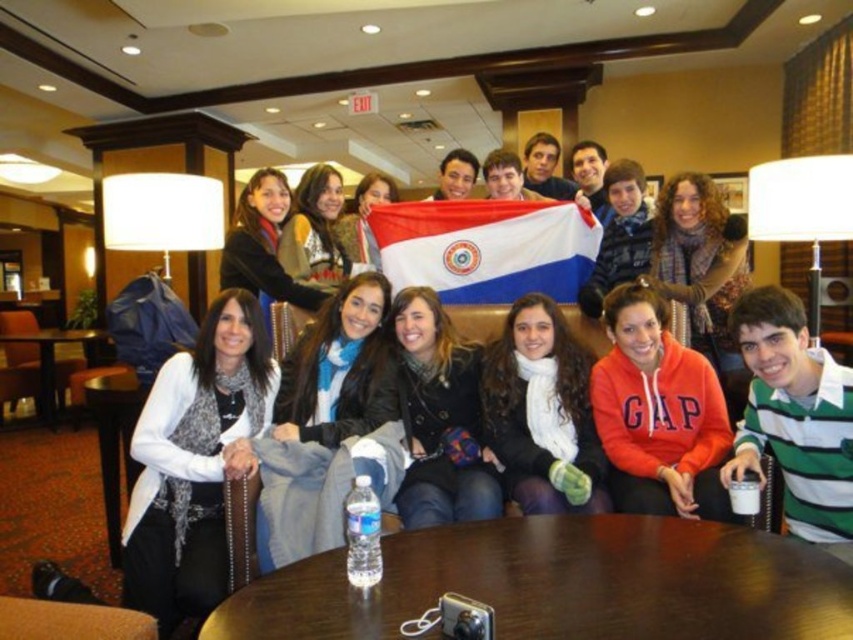
Question: Is wooden table at lower left in front of brown wooden table at lower left?

Choices:
 (A) no
 (B) yes

Answer: (B)

Question: Which of the following is the farthest from the observer?

Choices:
 (A) brown wooden table at lower left
 (B) brown wooden table at center
 (C) wooden table at lower left
 (D) white fabric flag at center

Answer: (A)

Question: Can you confirm if brown wooden table at center is smaller than brown wooden table at lower left?

Choices:
 (A) no
 (B) yes

Answer: (B)

Question: Which of these objects is positioned farthest from the wooden table at lower left?

Choices:
 (A) white fabric flag at center
 (B) brown wooden table at lower left

Answer: (B)

Question: Which point is closer to the camera?

Choices:
 (A) brown wooden table at lower left
 (B) brown wooden table at center
 (C) wooden table at lower left

Answer: (B)

Question: In this image, where is white fabric flag at center located relative to brown wooden table at lower left?

Choices:
 (A) right
 (B) left

Answer: (A)